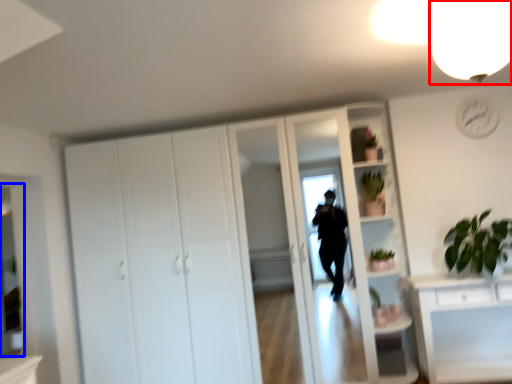
Question: Which point is further to the camera, light fixture (highlighted by a red box) or mirror (highlighted by a blue box)?

Choices:
 (A) light fixture
 (B) mirror

Answer: (B)